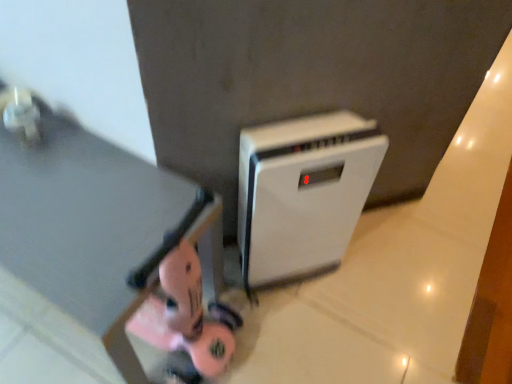
Image resolution: width=512 pixels, height=384 pixels. What do you see at coordinates (303, 192) in the screenshot? I see `white plastic air purifier at center` at bounding box center [303, 192].

At what (x,y) coordinates should I click in order to perform the action: click on white plastic air purifier at center. Please return your answer as a coordinate pair (x, y). This screenshot has width=512, height=384. Looking at the image, I should click on (303, 192).

Measure the distance between white plastic air purifier at center and camera.

36.20 inches.

This screenshot has width=512, height=384. Describe the element at coordinates (90, 234) in the screenshot. I see `matte black table at lower left` at that location.

Where is `matte black table at lower left`? The height and width of the screenshot is (384, 512). matte black table at lower left is located at coordinates (90, 234).

The image size is (512, 384). I want to click on white plastic air purifier at center, so click(x=303, y=192).

Considering the relative positions of white plastic air purifier at center and matte black table at lower left in the image provided, is white plastic air purifier at center to the left of matte black table at lower left from the viewer's perspective?

No.

From the picture: Relative to matte black table at lower left, is white plastic air purifier at center in front or behind?

Clearly, white plastic air purifier at center is behind matte black table at lower left.

Which is in front, point (320, 166) or point (71, 299)?

The point (71, 299) is closer.

From the image's perspective, which one is positioned lower, white plastic air purifier at center or matte black table at lower left?

matte black table at lower left appears lower in the image.

From a real-world perspective, is white plastic air purifier at center on top of matte black table at lower left?

Yes.

Looking at this image, considering the sizes of objects white plastic air purifier at center and matte black table at lower left in the image provided, who is thinner, white plastic air purifier at center or matte black table at lower left?

white plastic air purifier at center.

Can you confirm if white plastic air purifier at center is shorter than matte black table at lower left?

Incorrect, the height of white plastic air purifier at center does not fall short of that of matte black table at lower left.

Is white plastic air purifier at center smaller than matte black table at lower left?

Correct, white plastic air purifier at center occupies less space than matte black table at lower left.

Which is correct: white plastic air purifier at center is inside matte black table at lower left, or outside of it?

white plastic air purifier at center lies outside matte black table at lower left.

Looking at this image, are white plastic air purifier at center and matte black table at lower left located far from each other?

white plastic air purifier at center is actually quite close to matte black table at lower left.

Is white plastic air purifier at center positioned with its back to matte black table at lower left?

No, white plastic air purifier at center is not facing away from matte black table at lower left.

This screenshot has height=384, width=512. Find the location of `table in front of the white plastic air purifier at center`. table in front of the white plastic air purifier at center is located at coordinates (90, 234).

Considering the relative positions of matte black table at lower left and white plastic air purifier at center in the image provided, is matte black table at lower left to the right of white plastic air purifier at center from the viewer's perspective?

In fact, matte black table at lower left is to the left of white plastic air purifier at center.

Is matte black table at lower left behind white plastic air purifier at center?

No, matte black table at lower left is closer to the viewer.

Is point (52, 253) behind point (329, 256)?

No, it is in front of (329, 256).

From the image's perspective, is matte black table at lower left located beneath white plastic air purifier at center?

Correct, matte black table at lower left appears lower than white plastic air purifier at center in the image.

From a real-world perspective, is matte black table at lower left below white plastic air purifier at center?

Yes, from a real-world perspective, matte black table at lower left is under white plastic air purifier at center.

In the scene shown: Which of these two, matte black table at lower left or white plastic air purifier at center, is thinner?

white plastic air purifier at center.

Is matte black table at lower left taller or shorter than white plastic air purifier at center?

matte black table at lower left is shorter than white plastic air purifier at center.

Considering the sizes of objects matte black table at lower left and white plastic air purifier at center in the image provided, who is bigger, matte black table at lower left or white plastic air purifier at center?

matte black table at lower left is bigger.

Is matte black table at lower left completely or partially outside of white plastic air purifier at center?

matte black table at lower left is positioned outside white plastic air purifier at center.

Is matte black table at lower left next to white plastic air purifier at center?

No, matte black table at lower left is not in contact with white plastic air purifier at center.

Could you tell me if matte black table at lower left is facing white plastic air purifier at center?

No, matte black table at lower left is not aimed at white plastic air purifier at center.

How many degrees apart are the facing directions of matte black table at lower left and white plastic air purifier at center?

They differ by 48.5 degrees in their facing directions.

Measure the distance from matte black table at lower left to white plastic air purifier at center.

31.98 centimeters.

Where is `table on the left of white plastic air purifier at center`? table on the left of white plastic air purifier at center is located at coordinates (90, 234).

Locate an element on the screen. table lying below the white plastic air purifier at center (from the image's perspective) is located at coordinates (90, 234).

Identify the location of table in front of the white plastic air purifier at center. Image resolution: width=512 pixels, height=384 pixels. (90, 234).